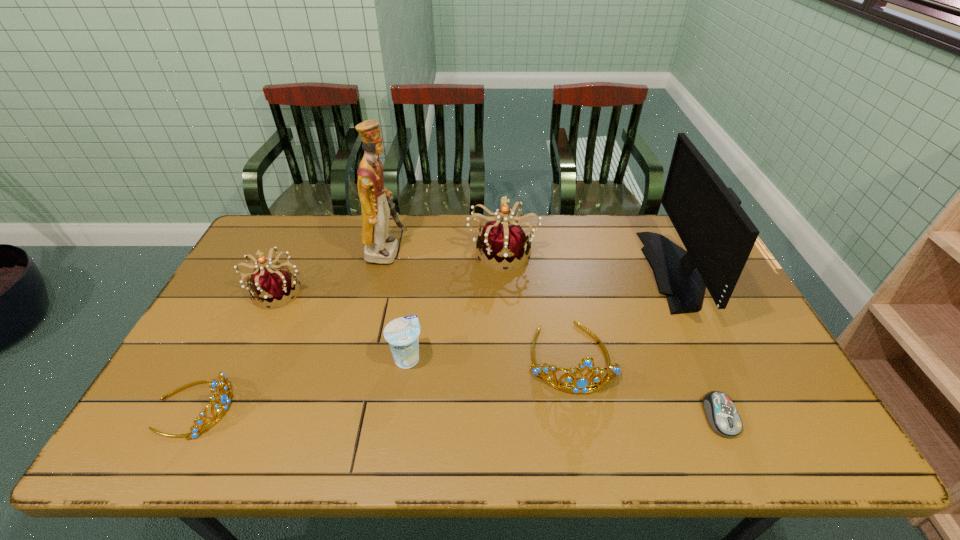
Where is `blue yogurt`? blue yogurt is located at coordinates (402, 334).

Find the location of a particular element. This screenshot has height=540, width=960. the shortest tiara is located at coordinates (225, 398).

The height and width of the screenshot is (540, 960). In order to click on the left gold tiara in this screenshot , I will do `click(225, 398)`.

At what (x,y) coordinates should I click in order to perform the action: click on the shortest object. Please return your answer as a coordinate pair (x, y). Looking at the image, I should click on (722, 415).

Locate an element on the screen. Image resolution: width=960 pixels, height=540 pixels. vacant space located 0.310m on the front-facing side of the red nutcracker is located at coordinates (494, 251).

This screenshot has width=960, height=540. What are the coordinates of `free spot located 0.070m on the screen side of the monitor` in the screenshot? It's located at (628, 270).

The image size is (960, 540). In order to click on vacant space situated 0.360m on the screen side of the monitor in this screenshot , I will do `click(540, 270)`.

Where is `free spot located on the screen side of the monitor`? This screenshot has height=540, width=960. free spot located on the screen side of the monitor is located at coordinates (622, 270).

At what (x,y) coordinates should I click in order to perform the action: click on free space located 0.290m on the front-facing side of the tallest tiara. Please return your answer as a coordinate pair (x, y). The width and height of the screenshot is (960, 540). Looking at the image, I should click on (508, 345).

Where is `vacant space positioned on the front-facing side of the fifth shortest object`? The height and width of the screenshot is (540, 960). vacant space positioned on the front-facing side of the fifth shortest object is located at coordinates (236, 377).